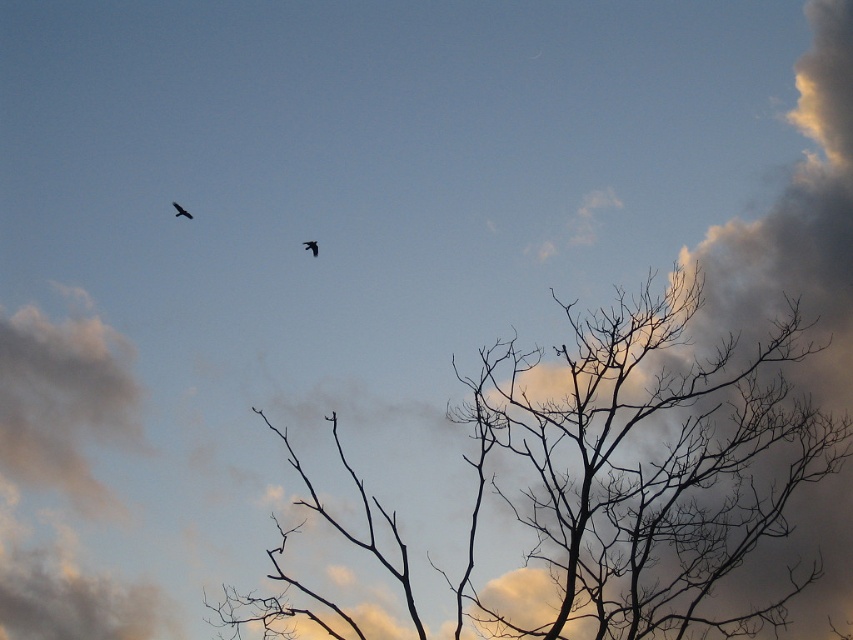
Describe the element at coordinates (180, 211) in the screenshot. The image size is (853, 640). I see `black matte bird at upper left` at that location.

Can you confirm if black matte bird at upper left is positioned below silhouette feathered bird at upper left?

Incorrect, black matte bird at upper left is not positioned below silhouette feathered bird at upper left.

Does point (186, 211) come in front of point (312, 253)?

Yes, point (186, 211) is in front of point (312, 253).

The width and height of the screenshot is (853, 640). In order to click on black matte bird at upper left in this screenshot , I will do `click(180, 211)`.

Which of these two, silhouette bare branches at center or silhouette feathered bird at upper left, stands shorter?

silhouette feathered bird at upper left

This screenshot has height=640, width=853. What do you see at coordinates (648, 468) in the screenshot?
I see `silhouette bare branches at center` at bounding box center [648, 468].

The width and height of the screenshot is (853, 640). Find the location of `silhouette bare branches at center`. silhouette bare branches at center is located at coordinates (648, 468).

Does silhouette bare branches at center come behind black matte bird at upper left?

Yes, silhouette bare branches at center is behind black matte bird at upper left.

Between point (584, 451) and point (177, 216), which one is positioned in front?

Point (177, 216)

Between point (781, 515) and point (175, 211), which one is positioned behind?

Point (781, 515)

This screenshot has width=853, height=640. Find the location of `silhouette bare branches at center`. silhouette bare branches at center is located at coordinates (648, 468).